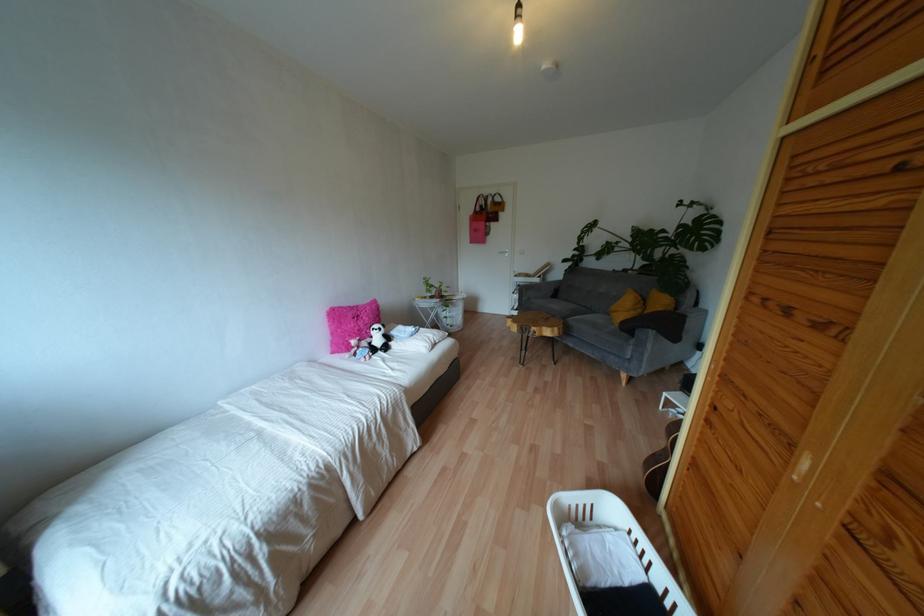
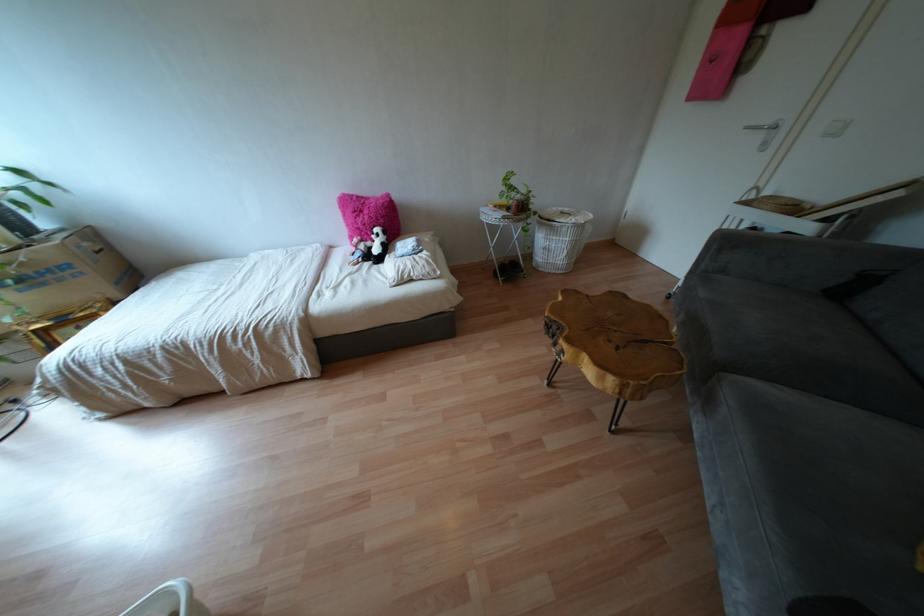
Locate, in the second image, the point that corresponds to the point at 518,254 in the first image.

(827, 134)